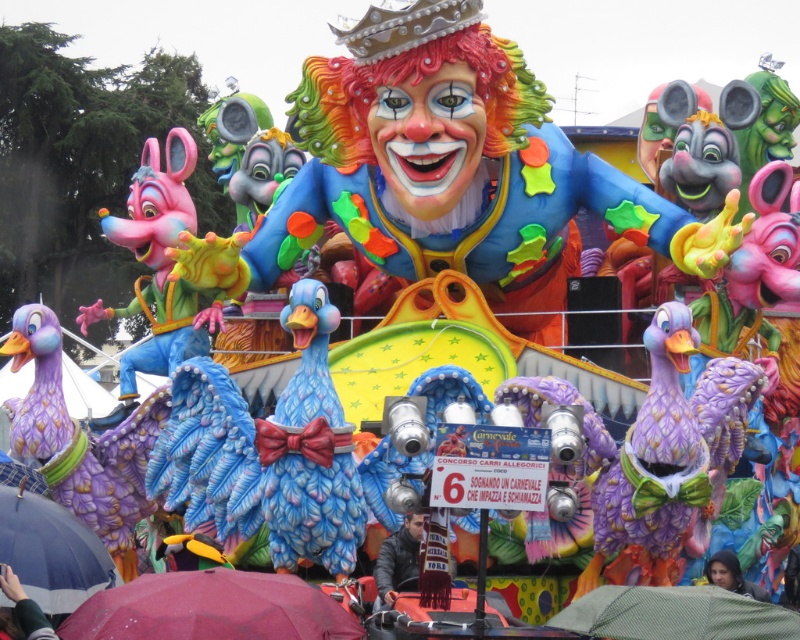
Question: Is dark gray jacket at center closer to the viewer compared to smooth skin face at center?

Choices:
 (A) no
 (B) yes

Answer: (B)

Question: Which point is closer to the camera?

Choices:
 (A) green mesh umbrella at lower center
 (B) dark gray fabric umbrella at lower left
 (C) maroon fabric umbrella at lower center

Answer: (C)

Question: Which object is positioned closest to the dark gray fabric umbrella at lower left?

Choices:
 (A) maroon fabric umbrella at lower center
 (B) blue fabric umbrella at lower left
 (C) pink glossy mouse at left

Answer: (B)

Question: Does green mesh umbrella at lower center appear on the right side of blue fabric umbrella at lower left?

Choices:
 (A) yes
 (B) no

Answer: (A)

Question: Based on their relative distances, which object is nearer to the green mesh umbrella at lower center?

Choices:
 (A) dark gray fabric umbrella at lower left
 (B) blue fabric umbrella at lower left
 (C) smooth skin face at center

Answer: (C)

Question: Is purple matte duck at left behind green mesh umbrella at lower center?

Choices:
 (A) no
 (B) yes

Answer: (B)